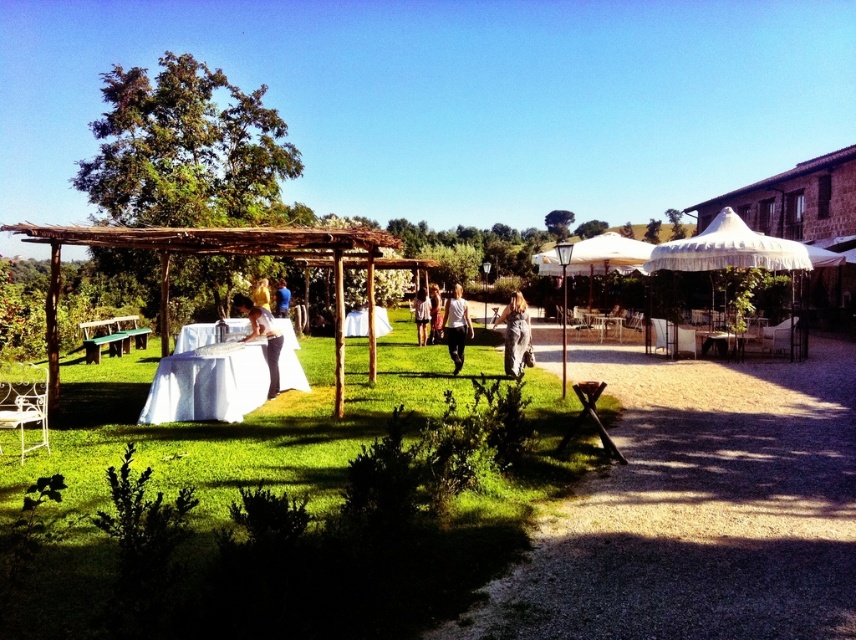
You are planning to place a new potted plant in the garden scene. You want to position it between the white wrought iron chair at lower left and the light brown wooden chair at center. Based on their current positions, which chair will be closer to the potted plant if placed exactly in the middle of the two?

The potted plant placed exactly in the middle between the white wrought iron chair at lower left and the light brown wooden chair at center will be equidistant from both chairs. However, since the white wrought iron chair at lower left is positioned to the left of the light brown wooden chair at center, the plant would be closer to the light brown wooden chair at center if placed slightly off the exact midpoint towards it.

You are organizing a clothing display in a store and have two items to place on a narrow shelf. The denim pants at center and the white cotton dress at center are both at the center. The shelf can only accommodate one item. Based on their widths, which item should you choose to fit on the shelf?

The white cotton dress at center has a smaller width compared to the denim pants at center, so it would fit better on the narrow shelf.